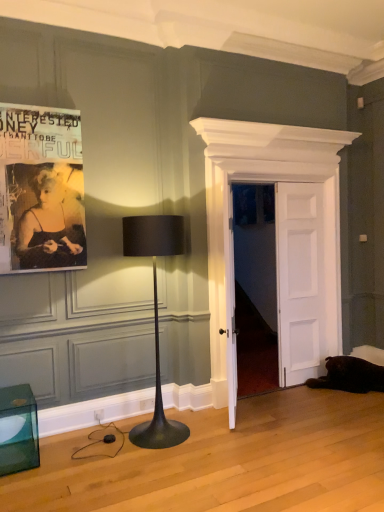
Question: From a real-world perspective, is matte black lamp at center-left located beneath white wooden door at center, which is the 2th door in left-to-right order?

Choices:
 (A) yes
 (B) no

Answer: (A)

Question: Is matte black lamp at center-left at the right side of white wooden door at center, which is the 2th door in left-to-right order?

Choices:
 (A) no
 (B) yes

Answer: (A)

Question: From a real-world perspective, is matte black lamp at center-left on top of white wooden door at center, which is the first door from right to left?

Choices:
 (A) no
 (B) yes

Answer: (A)

Question: Is matte black lamp at center-left not within white wooden door at center, which is the first door from right to left?

Choices:
 (A) no
 (B) yes

Answer: (B)

Question: Considering the relative sizes of matte black lamp at center-left and white wooden door at center, which is the 2th door in left-to-right order, in the image provided, is matte black lamp at center-left thinner than white wooden door at center, which is the 2th door in left-to-right order,?

Choices:
 (A) no
 (B) yes

Answer: (A)

Question: Is white wooden door at center, which is the first door from right to left, at the back of matte black lamp at center-left?

Choices:
 (A) no
 (B) yes

Answer: (A)

Question: From the image's perspective, would you say white wooden door at center, which is the 2th door in left-to-right order, is shown under black paper poster at upper left?

Choices:
 (A) no
 (B) yes

Answer: (B)

Question: From a real-world perspective, is white wooden door at center, which is the first door from right to left, positioned under black paper poster at upper left based on gravity?

Choices:
 (A) yes
 (B) no

Answer: (A)

Question: Does white wooden door at center, which is the first door from right to left, contain black paper poster at upper left?

Choices:
 (A) yes
 (B) no

Answer: (B)

Question: Considering the relative sizes of white wooden door at center, which is the first door from right to left, and black paper poster at upper left in the image provided, is white wooden door at center, which is the first door from right to left, thinner than black paper poster at upper left?

Choices:
 (A) yes
 (B) no

Answer: (B)

Question: Does white wooden door at center, which is the 2th door in left-to-right order, have a lesser height compared to black paper poster at upper left?

Choices:
 (A) no
 (B) yes

Answer: (A)

Question: Is white wooden door at center, which is the 2th door in left-to-right order, bigger than black paper poster at upper left?

Choices:
 (A) no
 (B) yes

Answer: (B)

Question: Does transparent glass cube at lower left have a lesser height compared to white wooden door at center, which ranks as the second door in right-to-left order?

Choices:
 (A) yes
 (B) no

Answer: (A)